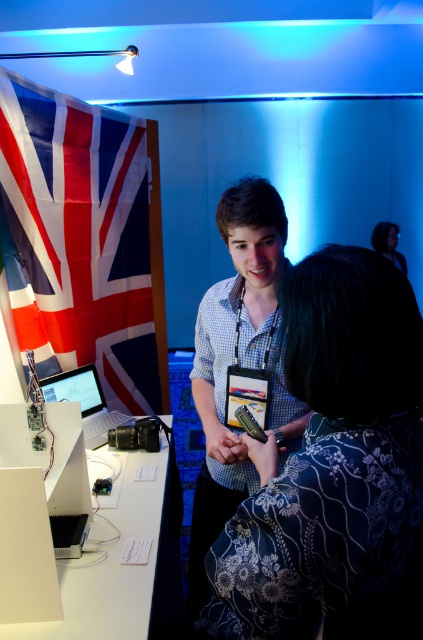
You are attending a tech exhibition and notice two items on the table. You need to place a protective cover over the silver metallic laptop at left. The cover is designed to fit items shorter than the checkered fabric shirt at center. Will the cover fit the laptop?

The checkered fabric shirt at center is taller than the silver metallic laptop at left. Since the cover is designed for items shorter than the shirt, the laptop is shorter than the shirt, so the cover will fit the silver metallic laptop at left.

You are attending a tech exhibition and need to place a new item on the table. The table has limited space. Which object, the white plastic computer at lower left or the black leather jacket at upper right, is shorter and thus easier to fit under a shelf?

The white plastic computer at lower left is not as tall as the black leather jacket at upper right, so it is shorter and easier to fit under the shelf.